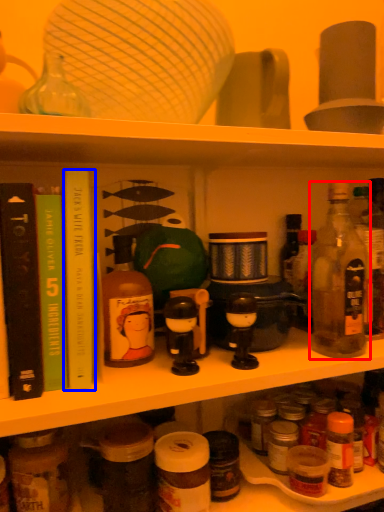
Question: Among these objects, which one is nearest to the camera, bottle (highlighted by a red box) or book (highlighted by a blue box)?

Choices:
 (A) bottle
 (B) book

Answer: (B)